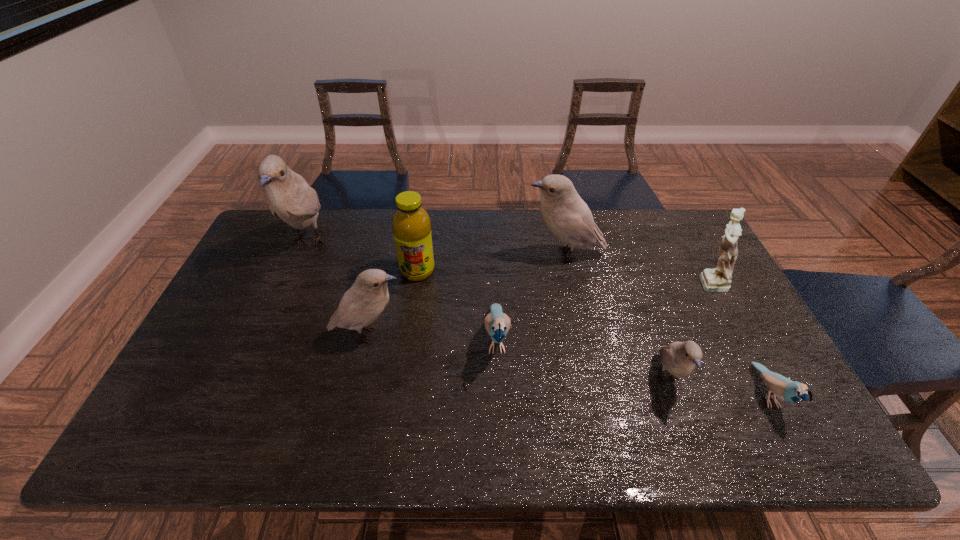
Locate an element on the screen. free region located on the front-facing side of the figurine is located at coordinates (587, 282).

Image resolution: width=960 pixels, height=540 pixels. Identify the location of free space located on the front label of the fruit juice. (407, 340).

This screenshot has height=540, width=960. Find the location of `vacant position located at the beak of the second smallest white bird`. vacant position located at the beak of the second smallest white bird is located at coordinates (475, 334).

Identify the location of vacant space situated 0.120m at the face of the third bird from left to right. (499, 420).

Find the location of a particular element. vacant space located at the face of the rightmost bird is located at coordinates (797, 450).

Locate an element on the screen. This screenshot has width=960, height=540. object at the near edge is located at coordinates click(790, 391).

The height and width of the screenshot is (540, 960). I want to click on object positioned at the left edge, so click(290, 197).

The width and height of the screenshot is (960, 540). What are the coordinates of `figurine that is at the right edge` in the screenshot? It's located at (718, 279).

I want to click on bird at the right edge, so click(790, 391).

Locate an element on the screen. This screenshot has height=540, width=960. object that is at the far left corner is located at coordinates (290, 197).